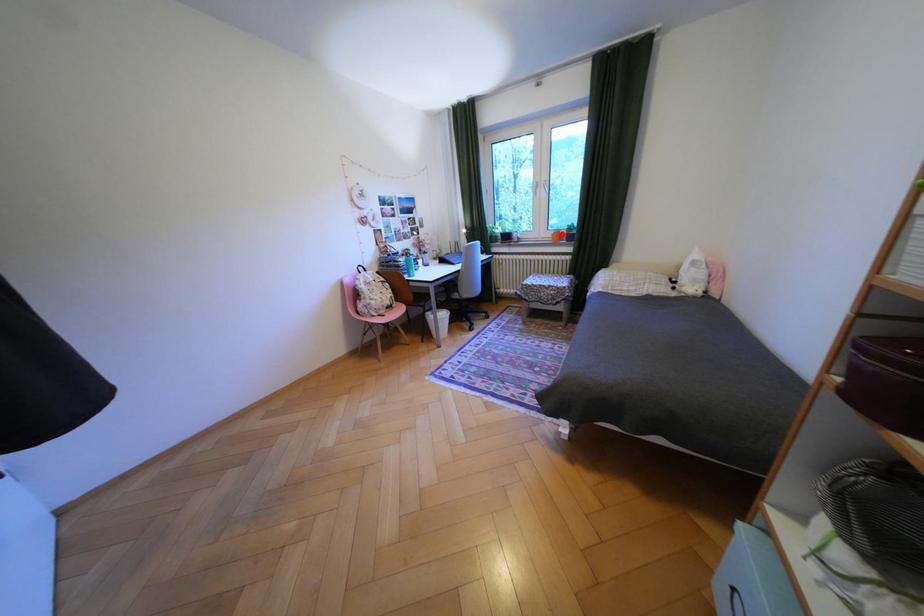
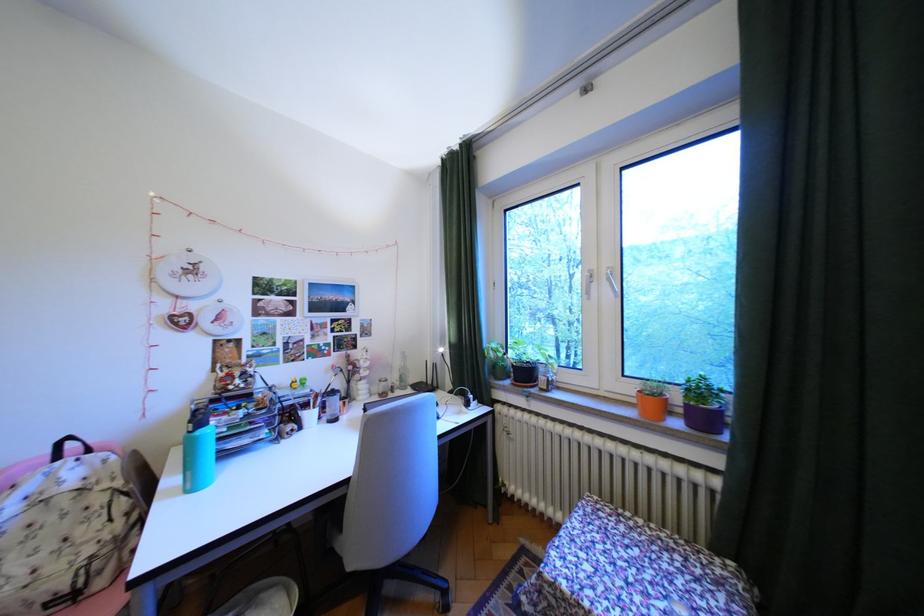
Question: A red point is marked in image1. In image2, is the corresponding 3D point closer to the camera or farther? Reply with the corresponding letter.

Choices:
 (A) The corresponding 3D point is closer.
 (B) The corresponding 3D point is farther.

Answer: (B)